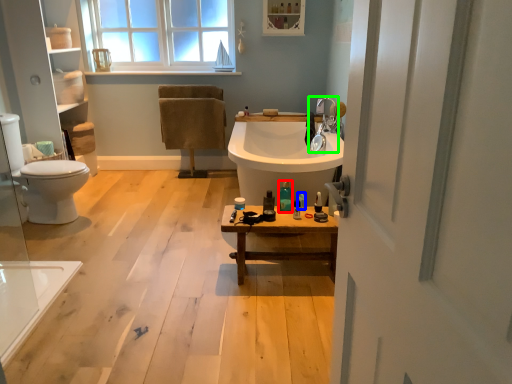
Question: Which object is the closest to the toiletry (highlighted by a red box)? Choose among these: toiletry (highlighted by a blue box) or tap (highlighted by a green box).

Choices:
 (A) toiletry
 (B) tap

Answer: (A)